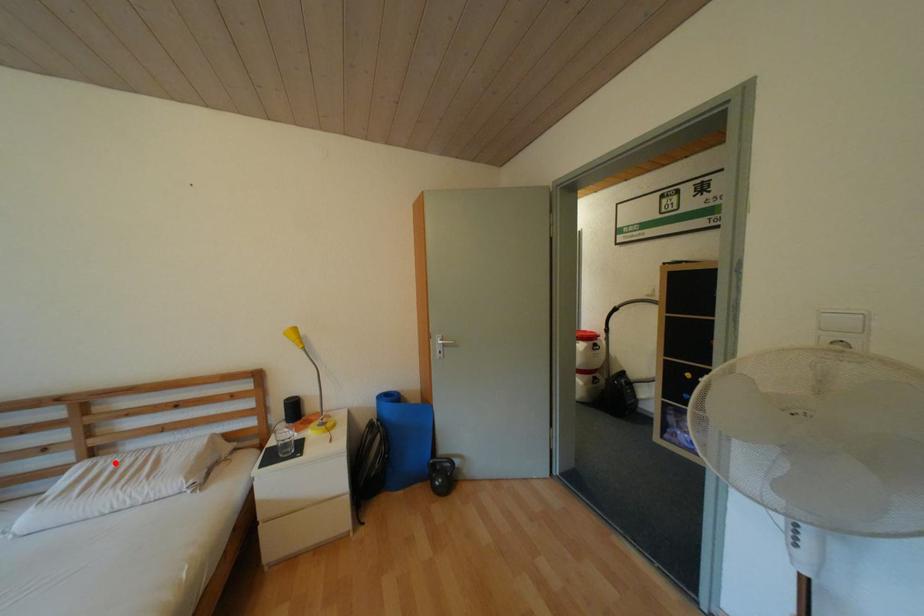
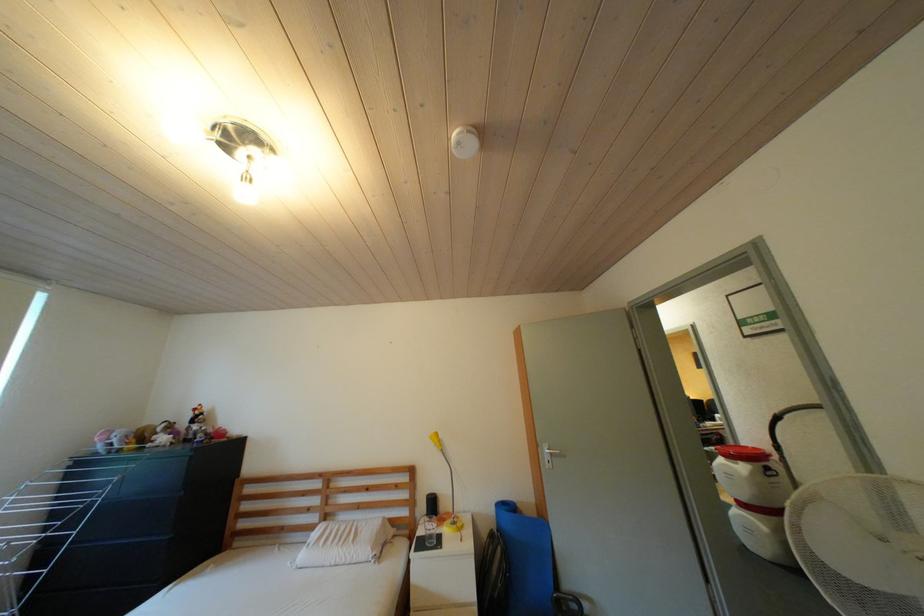
Locate, in the second image, the point that corresponds to the highlighted location in the first image.

(341, 527)